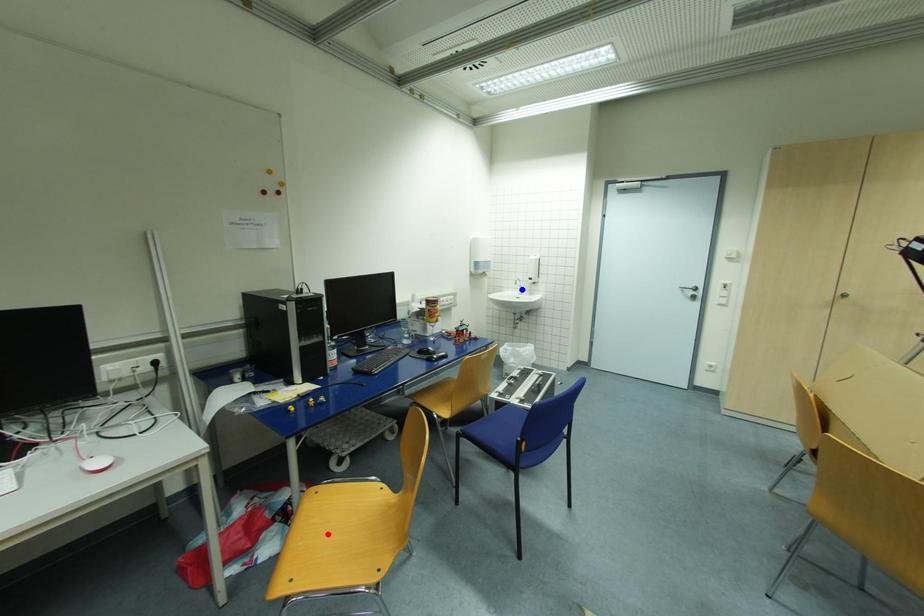
Question: Which of the two points in the image is closer to the camera?

Choices:
 (A) Blue point is closer.
 (B) Red point is closer.

Answer: (B)